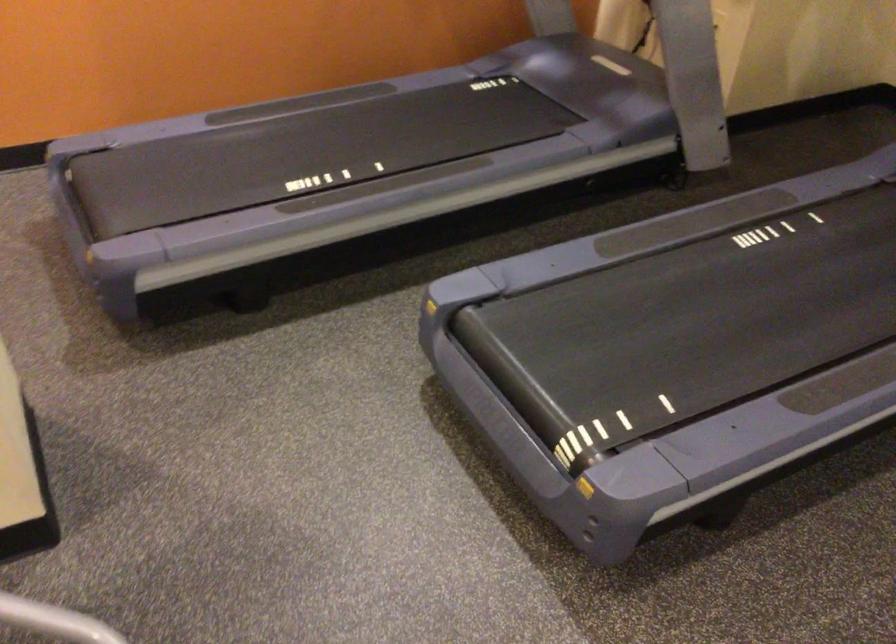
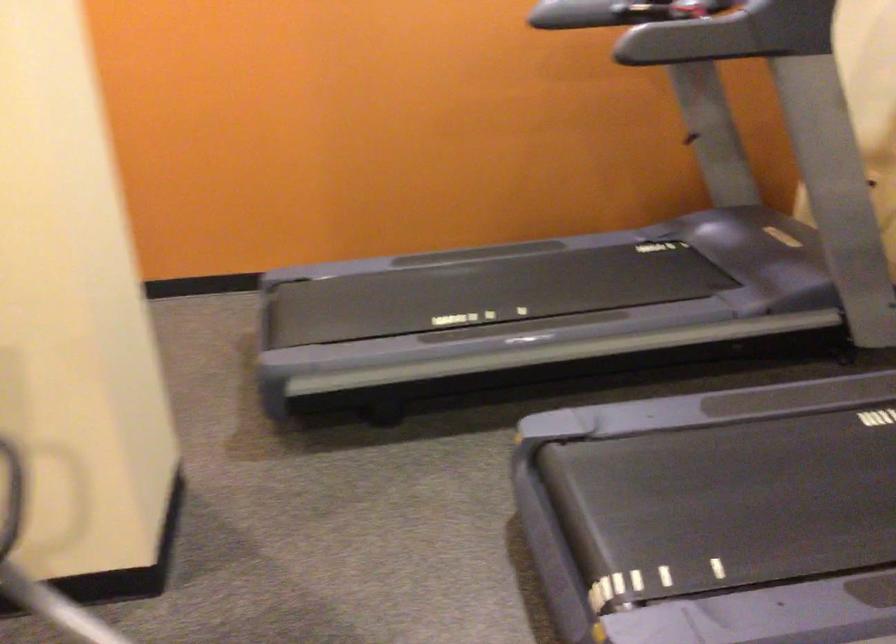
Question: Based on the continuous images, in which direction is the camera rotating? Reply with the corresponding letter.

Choices:
 (A) Left
 (B) Right
 (C) Up
 (D) Down

Answer: (A)